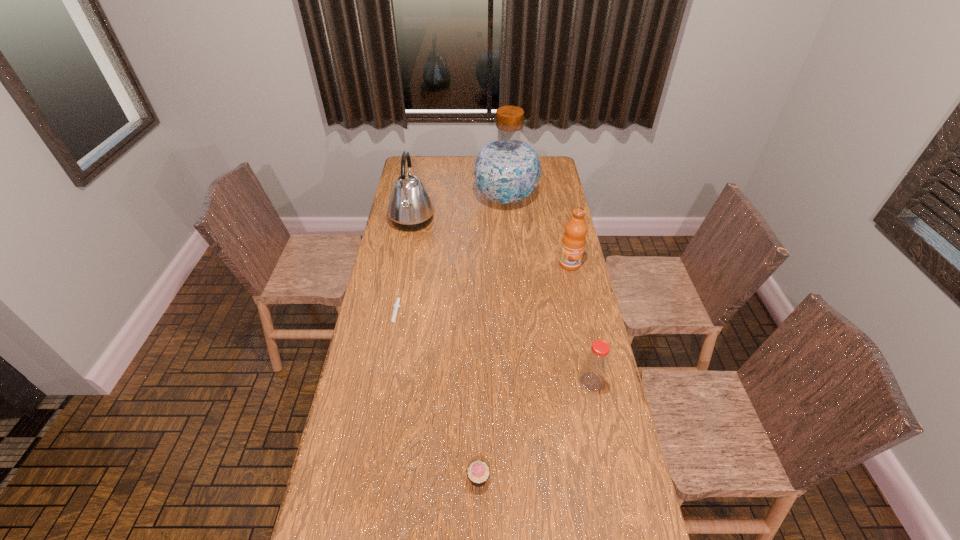
Find the location of a particular element. The height and width of the screenshot is (540, 960). water jug is located at coordinates (507, 170).

At what (x,y) coordinates should I click in order to perform the action: click on kettle. Please return your answer as a coordinate pair (x, y). The image size is (960, 540). Looking at the image, I should click on (410, 208).

The image size is (960, 540). I want to click on the third tallest object, so click(574, 239).

The image size is (960, 540). Identify the location of fruit juice. (574, 239).

Where is `the third shortest object`? the third shortest object is located at coordinates (595, 365).

The image size is (960, 540). I want to click on the fifth farthest object, so click(595, 365).

Find the location of `the nearest object`. the nearest object is located at coordinates (478, 472).

What are the coordinates of `cupcake` in the screenshot? It's located at (478, 472).

Where is `syringe`? The width and height of the screenshot is (960, 540). syringe is located at coordinates (x=396, y=305).

Identify the location of the shortest object. This screenshot has height=540, width=960. (396, 305).